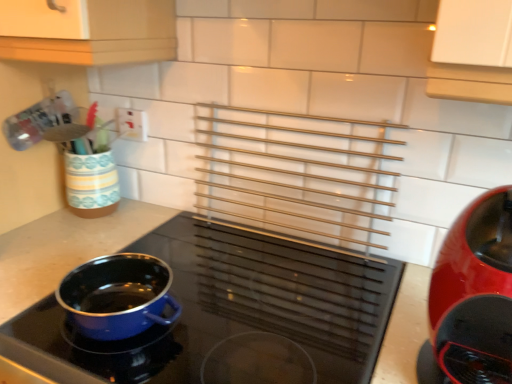
Question: Considering the relative positions of glossy plastic coffee maker at right, which ranks as the second kitchen appliance in left-to-right order, and blue enamel pot at center-left, placed as the first kitchen appliance when sorted from left to right, in the image provided, is glossy plastic coffee maker at right, which ranks as the second kitchen appliance in left-to-right order, to the right of blue enamel pot at center-left, placed as the first kitchen appliance when sorted from left to right, from the viewer's perspective?

Choices:
 (A) no
 (B) yes

Answer: (B)

Question: Can you confirm if glossy plastic coffee maker at right, positioned as the 1th kitchen appliance in right-to-left order, is positioned to the left of blue enamel pot at center-left, which is the 2th kitchen appliance in right-to-left order?

Choices:
 (A) no
 (B) yes

Answer: (A)

Question: Can you confirm if glossy plastic coffee maker at right, which ranks as the second kitchen appliance in left-to-right order, is wider than blue enamel pot at center-left, placed as the first kitchen appliance when sorted from left to right?

Choices:
 (A) yes
 (B) no

Answer: (B)

Question: From the image's perspective, is glossy plastic coffee maker at right, positioned as the 1th kitchen appliance in right-to-left order, below blue enamel pot at center-left, which is the 2th kitchen appliance in right-to-left order?

Choices:
 (A) yes
 (B) no

Answer: (B)

Question: Considering the relative sizes of glossy plastic coffee maker at right, positioned as the 1th kitchen appliance in right-to-left order, and blue enamel pot at center-left, placed as the first kitchen appliance when sorted from left to right, in the image provided, is glossy plastic coffee maker at right, positioned as the 1th kitchen appliance in right-to-left order, smaller than blue enamel pot at center-left, placed as the first kitchen appliance when sorted from left to right,?

Choices:
 (A) no
 (B) yes

Answer: (B)

Question: From the image's perspective, relative to blue enamel pot at center-left, which is the 2th kitchen appliance in right-to-left order, is white plastic electric outlet at upper left above or below?

Choices:
 (A) below
 (B) above

Answer: (B)

Question: Visually, is white plastic electric outlet at upper left positioned to the left or to the right of blue enamel pot at center-left, placed as the first kitchen appliance when sorted from left to right?

Choices:
 (A) left
 (B) right

Answer: (A)

Question: Is white plastic electric outlet at upper left taller or shorter than blue enamel pot at center-left, placed as the first kitchen appliance when sorted from left to right?

Choices:
 (A) tall
 (B) short

Answer: (B)

Question: From a real-world perspective, is white plastic electric outlet at upper left above or below blue enamel pot at center-left, which is the 2th kitchen appliance in right-to-left order?

Choices:
 (A) below
 (B) above

Answer: (B)

Question: From the image's perspective, relative to white plastic electric outlet at upper left, is blue enamel pot at center-left, placed as the first kitchen appliance when sorted from left to right, above or below?

Choices:
 (A) below
 (B) above

Answer: (A)

Question: Relative to white plastic electric outlet at upper left, is blue enamel pot at center-left, which is the 2th kitchen appliance in right-to-left order, in front or behind?

Choices:
 (A) behind
 (B) front

Answer: (B)

Question: From a real-world perspective, is blue enamel pot at center-left, which is the 2th kitchen appliance in right-to-left order, physically located above or below white plastic electric outlet at upper left?

Choices:
 (A) below
 (B) above

Answer: (A)

Question: In the image, is blue enamel pot at center-left, which is the 2th kitchen appliance in right-to-left order, on the left side or the right side of white plastic electric outlet at upper left?

Choices:
 (A) left
 (B) right

Answer: (B)

Question: From the image's perspective, is white plastic electric outlet at upper left above or below glossy plastic coffee maker at right, positioned as the 1th kitchen appliance in right-to-left order?

Choices:
 (A) below
 (B) above

Answer: (B)

Question: Which is correct: white plastic electric outlet at upper left is inside glossy plastic coffee maker at right, positioned as the 1th kitchen appliance in right-to-left order, or outside of it?

Choices:
 (A) outside
 (B) inside

Answer: (A)